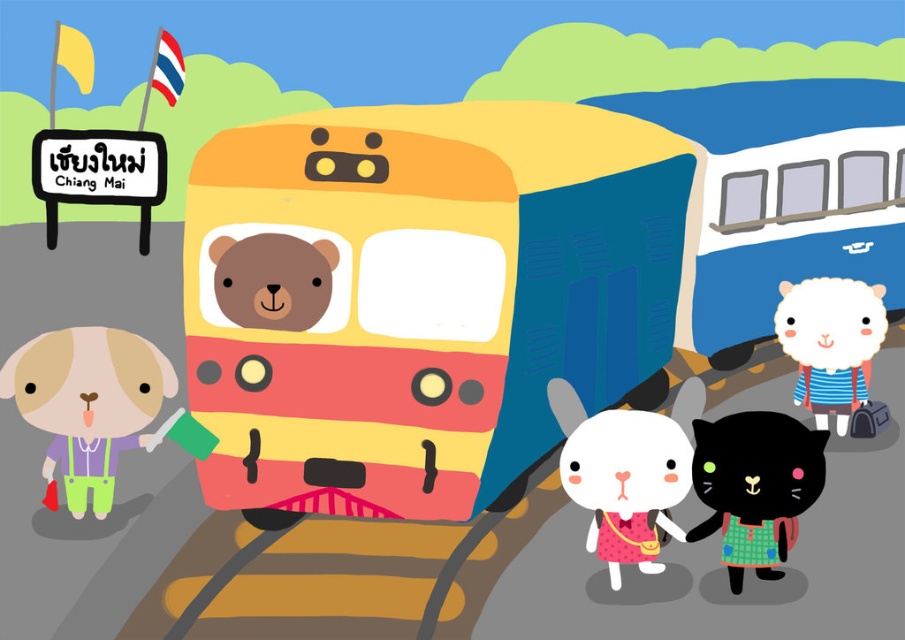
Question: Which of the following is the farthest from the observer?

Choices:
 (A) yellow matte train at center
 (B) black matte cat at lower right
 (C) pastel purple fabric dog at lower left
 (D) white woolen sheep at center

Answer: (D)

Question: Among these points, which one is nearest to the camera?

Choices:
 (A) (810, 292)
 (B) (687, 468)

Answer: (B)

Question: Is pastel purple fabric dog at lower left wider than white woolen sheep at center?

Choices:
 (A) yes
 (B) no

Answer: (A)

Question: Which point appears farthest from the camera in this image?

Choices:
 (A) (718, 440)
 (B) (218, 273)
 (C) (816, 369)
 (D) (105, 358)

Answer: (C)

Question: Is yellow matte train at center bigger than black matte cat at lower right?

Choices:
 (A) yes
 (B) no

Answer: (A)

Question: From the image, what is the correct spatial relationship of yellow matte train at center in relation to white woolen sheep at center?

Choices:
 (A) left
 (B) right

Answer: (A)